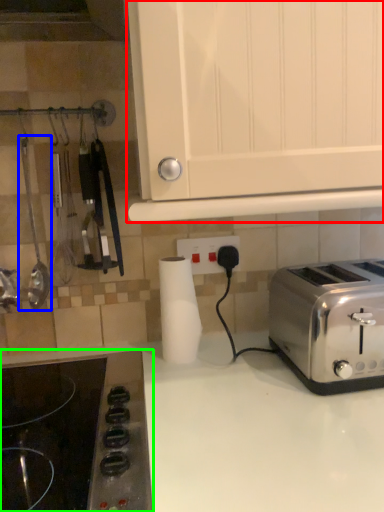
Question: Based on their relative distances, which object is farther from cabinetry (highlighted by a red box)? Choose from appliance (highlighted by a blue box) and gas stove (highlighted by a green box).

Choices:
 (A) appliance
 (B) gas stove

Answer: (A)